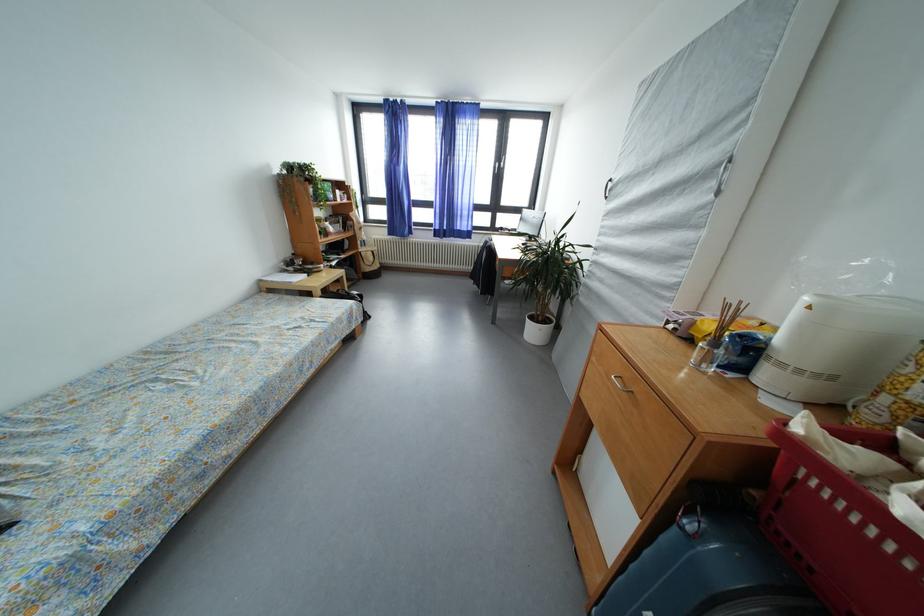
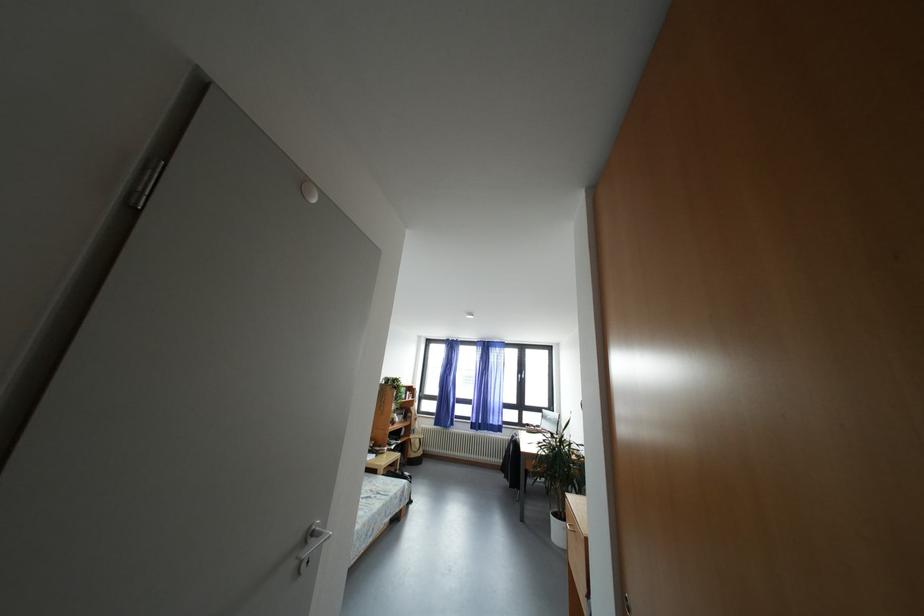
Locate, in the second image, the point that corresponds to pixel 507 233 in the first image.

(533, 430)